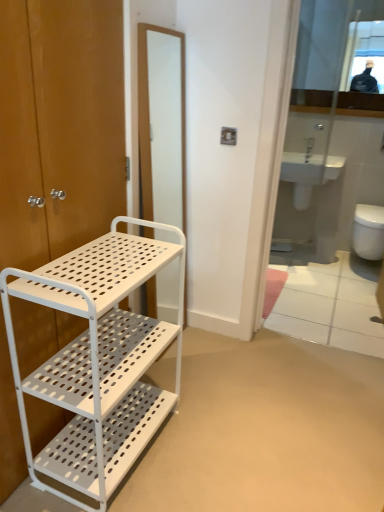
This screenshot has width=384, height=512. Describe the element at coordinates (98, 359) in the screenshot. I see `white perforated metal shelf at left` at that location.

What do you see at coordinates (308, 174) in the screenshot?
I see `white ceramic sink at center` at bounding box center [308, 174].

What do you see at coordinates (330, 133) in the screenshot? I see `glossy glass mirror at upper right, the 1th mirror positioned from the bottom` at bounding box center [330, 133].

Locate an element on the screen. glossy glass mirror at upper right, acting as the second mirror starting from the top is located at coordinates (330, 133).

This screenshot has width=384, height=512. In order to click on matte wood door at left in this screenshot , I will do `click(59, 125)`.

What do you see at coordinates (59, 125) in the screenshot? I see `matte wood door at left` at bounding box center [59, 125].

Locate an element on the screen. The height and width of the screenshot is (512, 384). white plastic bidet at center is located at coordinates (302, 196).

This screenshot has height=512, width=384. What are the coordinates of `white glossy toilet at right` in the screenshot? It's located at (369, 231).

The image size is (384, 512). What do you see at coordinates (339, 57) in the screenshot? I see `glossy glass mirror at upper right, the first mirror when ordered from top to bottom` at bounding box center [339, 57].

At what (x,y) coordinates should I click in order to perform the action: click on white matte screen door at center. Please return your answer as a coordinate pair (x, y). The height and width of the screenshot is (512, 384). Looking at the image, I should click on (162, 124).

Based on the photo, from a real-world perspective, is white glossy toilet at right above or below white plastic bidet at center?

Clearly, from a real-world perspective, white glossy toilet at right is below white plastic bidet at center.

Consider the image. Considering the relative positions of white glossy toilet at right and white plastic bidet at center in the image provided, is white glossy toilet at right in front of white plastic bidet at center?

Yes, the depth of white glossy toilet at right is less than that of white plastic bidet at center.

Is white glossy toilet at right not within white plastic bidet at center?

Indeed, white glossy toilet at right is completely outside white plastic bidet at center.

Considering the points (368, 249) and (299, 188), which point is in front, point (368, 249) or point (299, 188)?

The point (368, 249) is more forward.

Is glossy glass mirror at upper right, the 1th mirror positioned from the bottom, wider than white ceramic sink at center?

No.

Could you tell me if glossy glass mirror at upper right, the 1th mirror positioned from the bottom, is turned towards white ceramic sink at center?

No, glossy glass mirror at upper right, the 1th mirror positioned from the bottom, is not aimed at white ceramic sink at center.

How many degrees apart are the facing directions of glossy glass mirror at upper right, the 1th mirror positioned from the bottom, and white ceramic sink at center?

The facing directions of glossy glass mirror at upper right, the 1th mirror positioned from the bottom, and white ceramic sink at center are 0.51 degrees apart.

From a real-world perspective, is white plastic bidet at center beneath matte wood door at left?

Yes, from a real-world perspective, white plastic bidet at center is below matte wood door at left.

Between white plastic bidet at center and matte wood door at left, which one has larger size?

Bigger between the two is matte wood door at left.

Is white plastic bidet at center positioned with its back to matte wood door at left?

No.

Is point (298, 190) positioned in front of point (40, 258)?

No, it is behind (40, 258).

Considering the positions of objects white plastic bidet at center and white glossy toilet at right in the image provided, who is more to the left, white plastic bidet at center or white glossy toilet at right?

Positioned to the left is white plastic bidet at center.

Is point (306, 202) closer to viewer compared to point (381, 231)?

No.

Could you tell me if white plastic bidet at center is facing white glossy toilet at right?

A: No, white plastic bidet at center does not turn towards white glossy toilet at right.

From the image's perspective, between white plastic bidet at center and white matte screen door at center, which one is located above?

white plastic bidet at center.

Find the location of a particular element. This screenshot has width=384, height=512. screen door in front of the white plastic bidet at center is located at coordinates (162, 124).

Is white plastic bidet at center looking in the opposite direction of white matte screen door at center?

No, white plastic bidet at center is not facing away from white matte screen door at center.

From a real-world perspective, relative to white matte screen door at center, is white plastic bidet at center vertically above or below?

Clearly, from a real-world perspective, white plastic bidet at center is below white matte screen door at center.

From a real-world perspective, is white ceramic sink at center beneath matte wood door at left?

Yes, from a real-world perspective, white ceramic sink at center is below matte wood door at left.

From the image's perspective, is white ceramic sink at center beneath matte wood door at left?

No, from the image's perspective, white ceramic sink at center is not below matte wood door at left.

Is white ceramic sink at center smaller than matte wood door at left?

Yes, white ceramic sink at center is smaller than matte wood door at left.

Between white ceramic sink at center and matte wood door at left, which one has smaller width?

Thinner between the two is matte wood door at left.

Which of these two, glossy glass mirror at upper right, the first mirror when ordered from top to bottom, or white plastic bidet at center, is bigger?

glossy glass mirror at upper right, the first mirror when ordered from top to bottom, is bigger.

The height and width of the screenshot is (512, 384). I want to click on bidet on the left of glossy glass mirror at upper right, the second mirror from the bottom, so click(x=302, y=196).

From the image's perspective, which is above, glossy glass mirror at upper right, acting as the 2th mirror starting from the front, or white plastic bidet at center?

From the image's view, glossy glass mirror at upper right, acting as the 2th mirror starting from the front, is above.

Locate an element on the screen. bidet above the white glossy toilet at right (from a real-world perspective) is located at coordinates (302, 196).

From the white ceramic sink at center, count 2nd mirrors forward and point to it. Please provide its 2D coordinates.

[(330, 133)]

When comparing their distances from glossy glass mirror at upper right, acting as the second mirror starting from the top, does matte wood door at left or white matte screen door at center seem further?

Among the two, matte wood door at left is located further to glossy glass mirror at upper right, acting as the second mirror starting from the top.

Which object lies nearer to the anchor point glossy glass mirror at upper right, which ranks as the second mirror in back-to-front order, white perforated metal shelf at left or white matte screen door at center?

The object closer to glossy glass mirror at upper right, which ranks as the second mirror in back-to-front order, is white matte screen door at center.

Based on their spatial positions, is white ceramic sink at center or white glossy toilet at right further from matte wood door at left?

Based on the image, white glossy toilet at right appears to be further to matte wood door at left.

From the image, which object appears to be nearer to glossy glass mirror at upper right, which ranks as the second mirror in back-to-front order, white matte screen door at center or white perforated metal shelf at left?

The object closer to glossy glass mirror at upper right, which ranks as the second mirror in back-to-front order, is white matte screen door at center.

From the image, which object appears to be farther from white matte screen door at center, white plastic bidet at center or white ceramic sink at center?

white plastic bidet at center is positioned further to the anchor white matte screen door at center.

Which object lies nearer to the anchor point white glossy toilet at right, matte wood door at left or white plastic bidet at center?

white plastic bidet at center lies closer to white glossy toilet at right than the other object.

In the scene shown: Estimate the real-world distances between objects in this image. Which object is closer to white ceramic sink at center, matte wood door at left or white perforated metal shelf at left?

matte wood door at left is positioned closer to the anchor white ceramic sink at center.

Estimate the real-world distances between objects in this image. Which object is further from white glossy toilet at right, white perforated metal shelf at left or glossy glass mirror at upper right, the first mirror when ordered from top to bottom?

white perforated metal shelf at left is further to white glossy toilet at right.

What are the coordinates of `bathroom cabinet between matte wood door at left and white glossy toilet at right in the front-back direction` in the screenshot? It's located at (98, 359).

Image resolution: width=384 pixels, height=512 pixels. What are the coordinates of `bathroom cabinet between matte wood door at left and glossy glass mirror at upper right, the first mirror when ordered from top to bottom, along the z-axis` in the screenshot? It's located at (98, 359).

You are a GUI agent. You are given a task and a screenshot of the screen. Output one action in this format:
    pyautogui.click(x=<x>, y=<y>)
    Task: Click on the screen door positioned between matte wood door at left and white plastic bidet at center from near to far
    This screenshot has height=512, width=384.
    Given the screenshot: What is the action you would take?
    tap(162, 124)

Where is `screen door between glossy glass mirror at upper right, which ranks as the second mirror in back-to-front order, and white ceramic sink at center from front to back`? Image resolution: width=384 pixels, height=512 pixels. screen door between glossy glass mirror at upper right, which ranks as the second mirror in back-to-front order, and white ceramic sink at center from front to back is located at coordinates (162, 124).